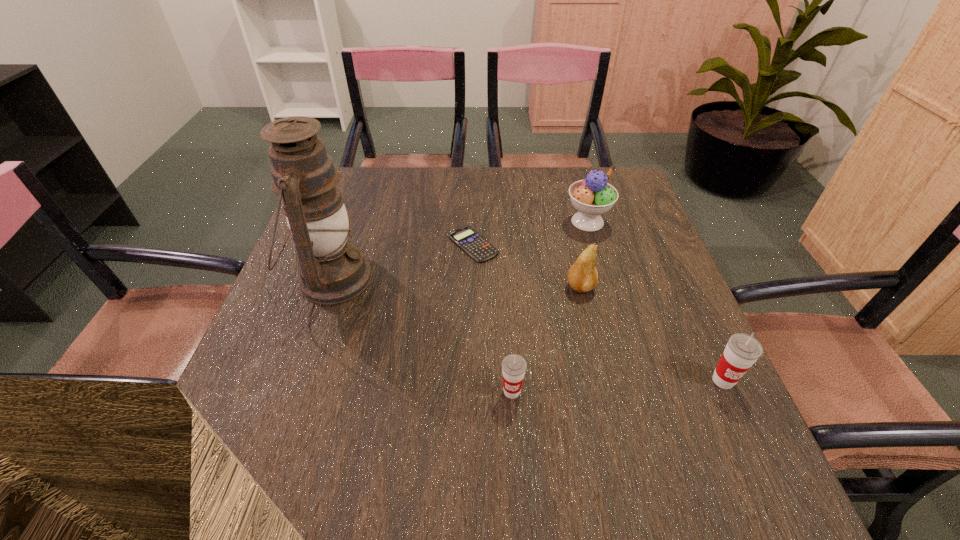
Given the evenly spaced cups in the image, where should an extra cup be added on the left to preserve the spacing? Please point to a vacant space. Please provide its 2D coordinates. Your answer should be formatted as a tuple, i.e. [(x, y)], where the tuple contains the x and y coordinates of a point satisfying the conditions above.

[(292, 403)]